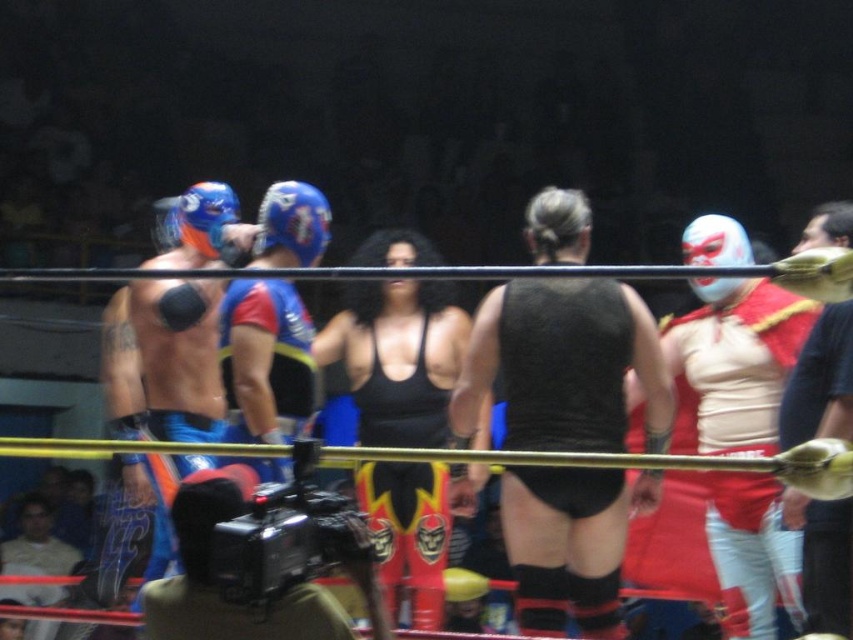
In the scene shown: Can you confirm if black matte vest at center is wider than matte black wrestling mask at lower left?

Yes, black matte vest at center is wider than matte black wrestling mask at lower left.

Is black matte vest at center to the right of matte black wrestling mask at lower left from the viewer's perspective?

Correct, you'll find black matte vest at center to the right of matte black wrestling mask at lower left.

In order to click on black matte vest at center in this screenshot , I will do `click(564, 365)`.

You are a GUI agent. You are given a task and a screenshot of the screen. Output one action in this format:
    pyautogui.click(x=<x>, y=<y>)
    Task: Click on the matte white mask at center
    The width and height of the screenshot is (853, 640).
    Given the screenshot: What is the action you would take?
    pyautogui.click(x=820, y=381)

Is point (816, 573) in front of point (39, 541)?

Yes.

The width and height of the screenshot is (853, 640). I want to click on matte white mask at center, so click(x=820, y=381).

Is shiny blue helmet at center above matte black wrestling mask at lower left?

Correct, shiny blue helmet at center is located above matte black wrestling mask at lower left.

Does shiny blue helmet at center have a larger size compared to matte black wrestling mask at lower left?

Actually, shiny blue helmet at center might be smaller than matte black wrestling mask at lower left.

Is point (267, 480) behind point (10, 552)?

No, (267, 480) is closer to viewer.

You are a GUI agent. You are given a task and a screenshot of the screen. Output one action in this format:
    pyautogui.click(x=<x>, y=<y>)
    Task: Click on the shiny blue helmet at center
    The image size is (853, 640).
    Given the screenshot: What is the action you would take?
    pyautogui.click(x=265, y=360)